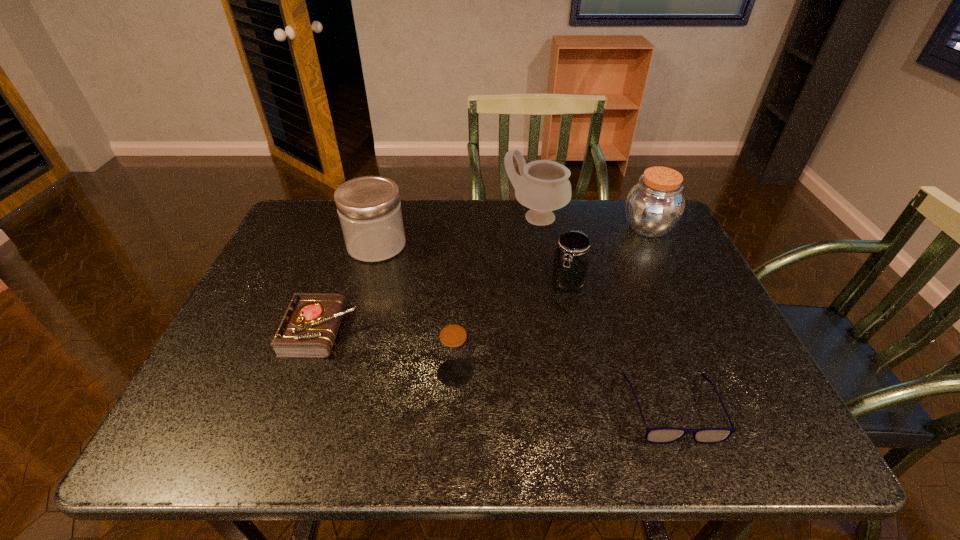
Select which jar appears as the third closest to the diary. Please provide its 2D coordinates. Your answer should be formatted as a tuple, i.e. [(x, y)], where the tuple contains the x and y coordinates of a point satisfying the conditions above.

[(570, 266)]

Point out which jar is positioned as the third nearest to the second nearest jar. Please provide its 2D coordinates. Your answer should be formatted as a tuple, i.e. [(x, y)], where the tuple contains the x and y coordinates of a point satisfying the conditions above.

[(369, 208)]

You are a GUI agent. You are given a task and a screenshot of the screen. Output one action in this format:
    pyautogui.click(x=<x>, y=<y>)
    Task: Click on the vacant space that satisfies the following two spatial constraints: 1. on the back side of the fifth object from right to left; 2. on the left side of the rightmost jar
    This screenshot has width=960, height=540.
    Given the screenshot: What is the action you would take?
    pyautogui.click(x=463, y=227)

Locate an element on the screen. The width and height of the screenshot is (960, 540). free region that satisfies the following two spatial constraints: 1. on the back side of the leftmost jar; 2. on the right side of the pottery is located at coordinates (384, 218).

This screenshot has height=540, width=960. In order to click on free location that satisfies the following two spatial constraints: 1. on the front side of the leftmost jar; 2. on the right side of the fifth object from right to left in this screenshot , I will do `click(341, 373)`.

Locate an element on the screen. The image size is (960, 540). vacant region that satisfies the following two spatial constraints: 1. on the back side of the rightmost jar; 2. on the left side of the leftmost jar is located at coordinates (381, 227).